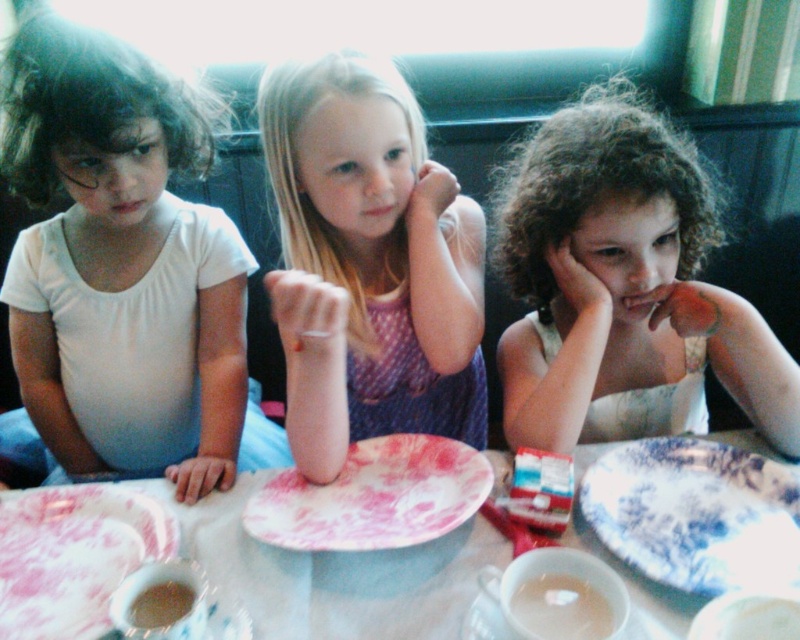
Can you confirm if pink fabric dress at center is positioned to the right of white paper plate at center?

In fact, pink fabric dress at center is to the left of white paper plate at center.

The width and height of the screenshot is (800, 640). I want to click on pink fabric dress at center, so click(368, 262).

Who is taller, white matte shirt at left or pink fabric dress at center?

Standing taller between the two is white matte shirt at left.

Is white matte shirt at left to the left of pink fabric dress at center from the viewer's perspective?

Indeed, white matte shirt at left is positioned on the left side of pink fabric dress at center.

Is point (38, 52) closer to viewer compared to point (304, 320)?

No, (38, 52) is behind (304, 320).

Locate an element on the screen. white matte shirt at left is located at coordinates (124, 268).

Is white paper plate at center to the right of blue porcelain plate at lower right from the viewer's perspective?

In fact, white paper plate at center is to the left of blue porcelain plate at lower right.

Is point (354, 628) closer to camera compared to point (758, 470)?

Yes, point (354, 628) is in front of point (758, 470).

This screenshot has height=640, width=800. In order to click on white paper plate at center in this screenshot , I will do `click(334, 573)`.